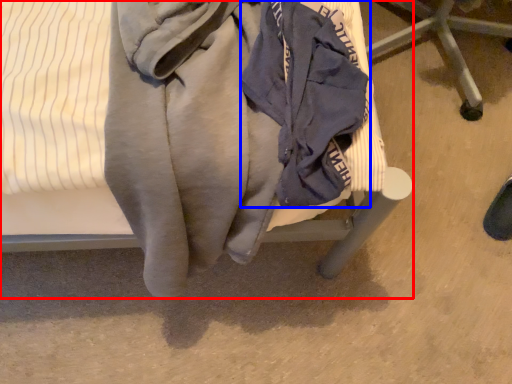
Question: Which of the following is the closest to the observer, furniture (highlighted by a red box) or garment (highlighted by a blue box)?

Choices:
 (A) furniture
 (B) garment

Answer: (A)